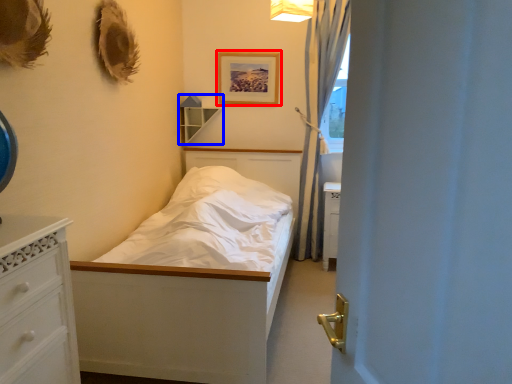
Question: Which point is further to the camera, picture frame (highlighted by a red box) or shelf (highlighted by a blue box)?

Choices:
 (A) picture frame
 (B) shelf

Answer: (B)